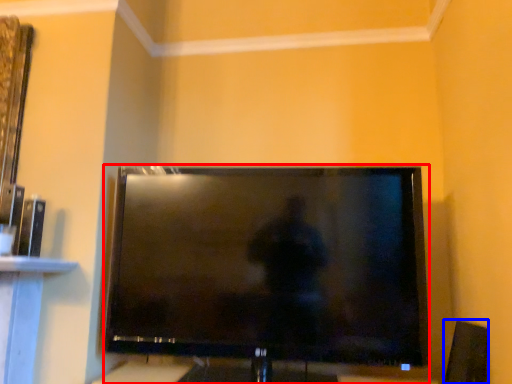
Question: Which of the following is the closest to the observer, television (highlighted by a red box) or speaker (highlighted by a blue box)?

Choices:
 (A) television
 (B) speaker

Answer: (A)